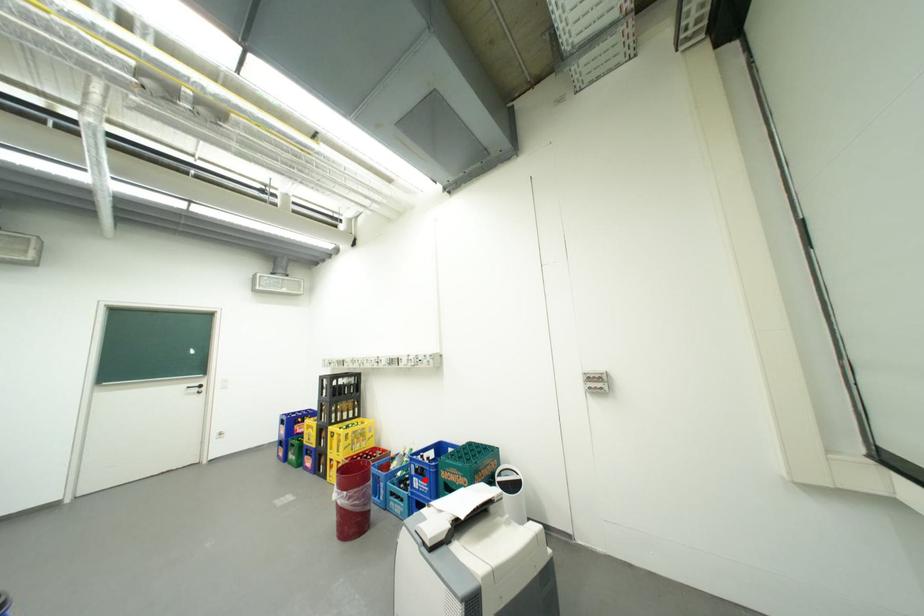
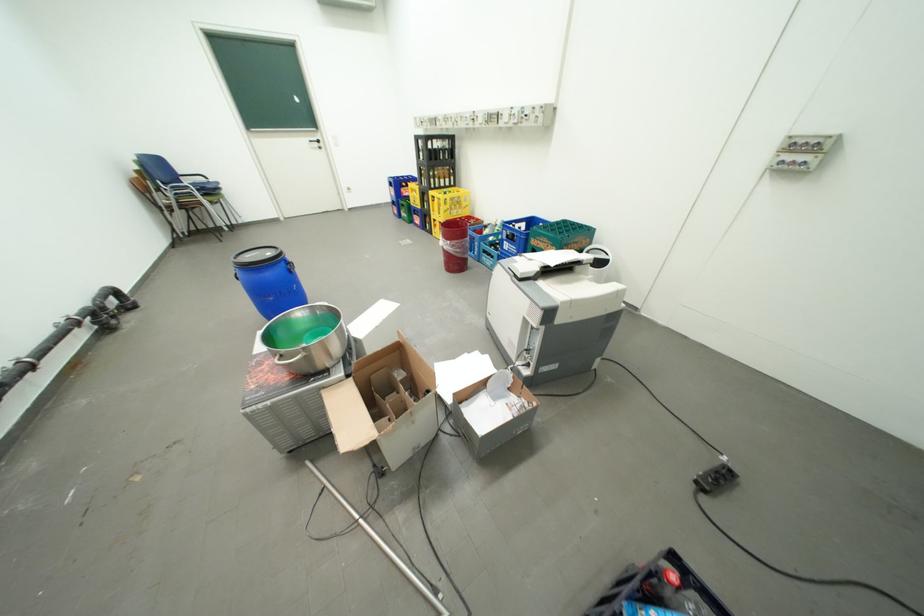
In the second image, find the point that corresponds to the highlighted location in the first image.

(516, 244)